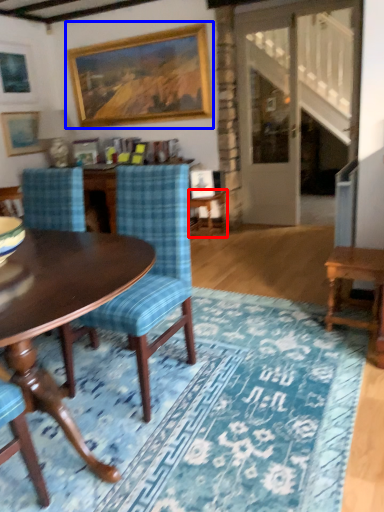
Question: Which point is further to the camera, side table (highlighted by a red box) or picture frame (highlighted by a blue box)?

Choices:
 (A) side table
 (B) picture frame

Answer: (A)